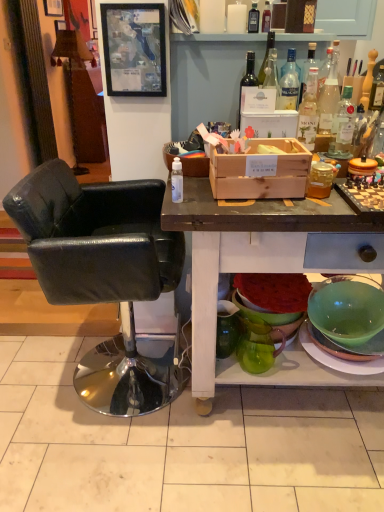
In order to click on free location in front of black leather chair at left in this screenshot , I will do `click(87, 460)`.